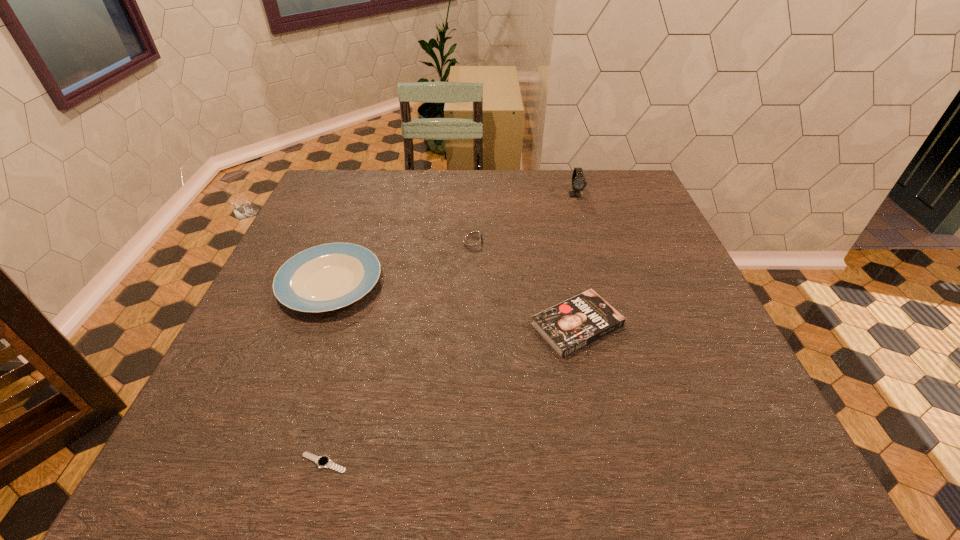
Where is `vacant space situated 0.220m on the face of the second farthest watch`? vacant space situated 0.220m on the face of the second farthest watch is located at coordinates (577, 240).

The width and height of the screenshot is (960, 540). I want to click on vacant space located 0.220m on the front of the book, so click(x=608, y=467).

Find the location of a particular element. The height and width of the screenshot is (540, 960). vacant region located 0.080m on the left of the nearest watch is located at coordinates (252, 463).

At what (x,y) coordinates should I click in order to perform the action: click on object at the far edge. Please return your answer as a coordinate pair (x, y). Image resolution: width=960 pixels, height=540 pixels. Looking at the image, I should click on point(578,180).

Find the location of a particular element. This screenshot has width=960, height=540. object that is at the near edge is located at coordinates (322, 461).

Identify the location of object that is at the left edge. This screenshot has width=960, height=540. pos(326,277).

This screenshot has width=960, height=540. Find the location of `vacant space at the far edge`. vacant space at the far edge is located at coordinates (426, 181).

In the image, there is a desktop. At what (x,y) coordinates should I click in order to perform the action: click on vacant space at the near edge. Please return your answer as a coordinate pair (x, y). Looking at the image, I should click on (464, 431).

In the image, there is a desktop. Where is `vacant space at the left edge`? vacant space at the left edge is located at coordinates (299, 358).

I want to click on free space at the right edge of the desktop, so click(x=683, y=290).